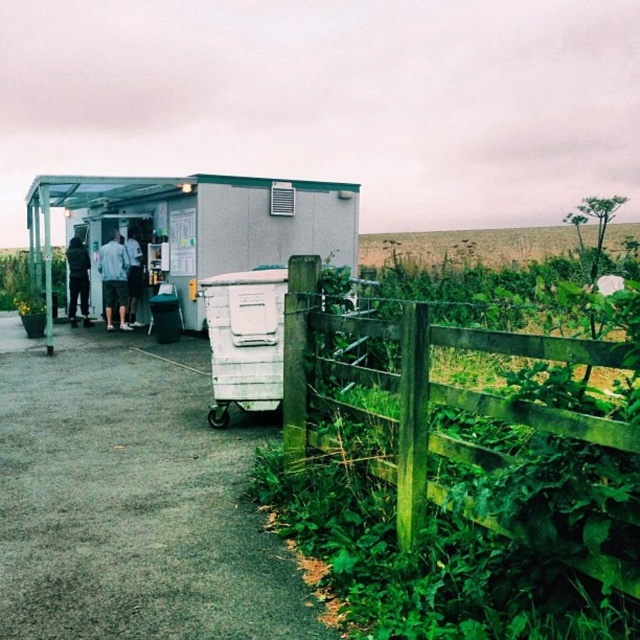
You are a customer at the food trailer and want to find the exit to leave the area. You see a green wooden fence at lower right and a white shirt at center. Which object is closer to the exit?

The green wooden fence at lower right is located below the white shirt at center, so the white shirt at center is closer to the exit.